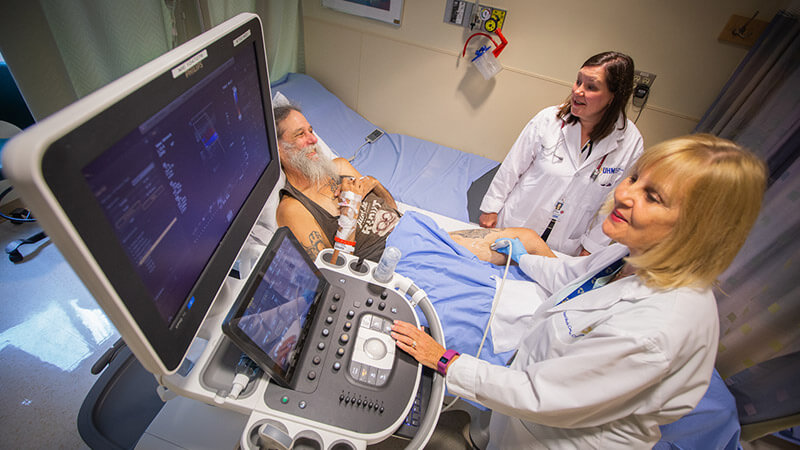
This screenshot has width=800, height=450. Identify the location of hospital beds. (422, 167), (478, 405), (10, 125).